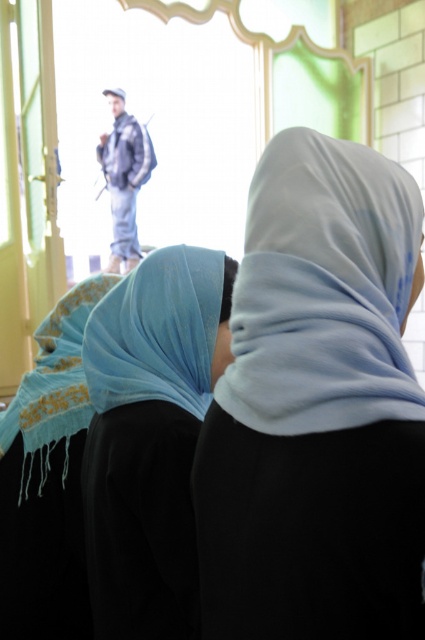
Consider the image. Does light blue fabric scarf at upper center appear under blue fabric headscarf at center?

Incorrect, light blue fabric scarf at upper center is not positioned below blue fabric headscarf at center.

Does light blue fabric scarf at upper center have a lesser height compared to blue fabric headscarf at center?

No, light blue fabric scarf at upper center is not shorter than blue fabric headscarf at center.

Where is `light blue fabric scarf at upper center`? light blue fabric scarf at upper center is located at coordinates (323, 291).

Find the location of a particular element. The image size is (425, 640). light blue fabric scarf at upper center is located at coordinates (323, 291).

Does light blue fabric scarf at upper center have a smaller size compared to turquoise woven shawl at lower left?

Indeed, light blue fabric scarf at upper center has a smaller size compared to turquoise woven shawl at lower left.

Who is more distant from viewer, (243, 372) or (62, 369)?

The point (62, 369) is behind.

At what (x,y) coordinates should I click in order to perform the action: click on light blue fabric scarf at upper center. Please return your answer as a coordinate pair (x, y). Image resolution: width=425 pixels, height=640 pixels. Looking at the image, I should click on (323, 291).

Does light blue sheer hijab at center appear on the left side of turquoise woven shawl at lower left?

Incorrect, light blue sheer hijab at center is not on the left side of turquoise woven shawl at lower left.

What are the coordinates of `light blue sheer hijab at center` in the screenshot? It's located at (150, 438).